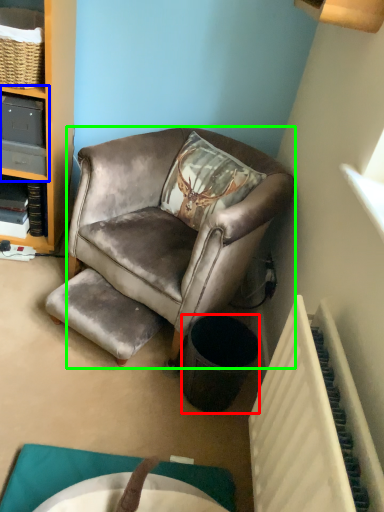
Question: Which is farther away from trash bin/can (highlighted by a red box)? shelf (highlighted by a blue box) or chair (highlighted by a green box)?

Choices:
 (A) shelf
 (B) chair

Answer: (A)